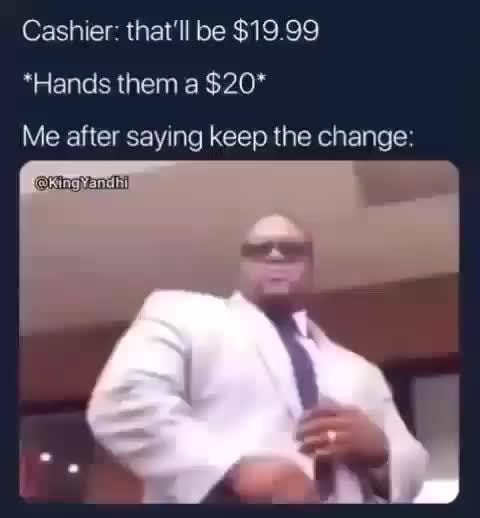
This screenshot has height=518, width=480. Find the location of `window`. window is located at coordinates (61, 435).